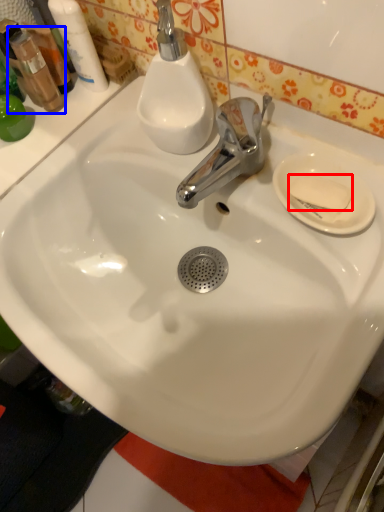
Question: Which point is further to the camera, soap (highlighted by a red box) or mouthwash (highlighted by a blue box)?

Choices:
 (A) soap
 (B) mouthwash

Answer: (B)